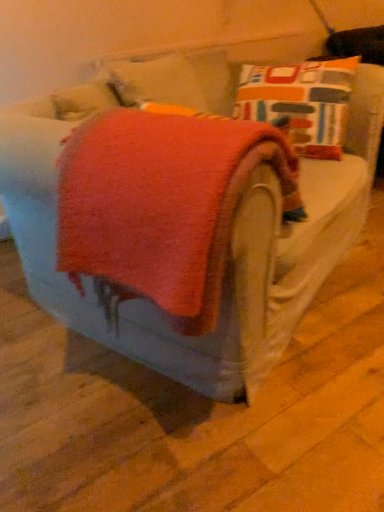
Question: Is orange soft towel at center beside orange fabric at center?

Choices:
 (A) no
 (B) yes

Answer: (A)

Question: Is orange soft towel at center positioned far away from orange fabric at center?

Choices:
 (A) no
 (B) yes

Answer: (A)

Question: Is orange soft towel at center oriented away from orange fabric at center?

Choices:
 (A) no
 (B) yes

Answer: (A)

Question: Is orange soft towel at center shorter than orange fabric at center?

Choices:
 (A) no
 (B) yes

Answer: (A)

Question: From a real-world perspective, is orange soft towel at center located beneath orange fabric at center?

Choices:
 (A) no
 (B) yes

Answer: (A)

Question: From the image's perspective, does orange soft towel at center appear lower than orange fabric at center?

Choices:
 (A) no
 (B) yes

Answer: (A)

Question: Can you confirm if orange fabric at center is thinner than orange soft towel at center?

Choices:
 (A) no
 (B) yes

Answer: (A)

Question: Considering the relative sizes of orange fabric at center and orange soft towel at center in the image provided, is orange fabric at center bigger than orange soft towel at center?

Choices:
 (A) no
 (B) yes

Answer: (B)

Question: Does orange fabric at center have a smaller size compared to orange soft towel at center?

Choices:
 (A) no
 (B) yes

Answer: (A)

Question: Is orange fabric at center not close to orange soft towel at center?

Choices:
 (A) no
 (B) yes

Answer: (A)

Question: Is orange fabric at center shorter than orange soft towel at center?

Choices:
 (A) no
 (B) yes

Answer: (B)

Question: From the image's perspective, is orange fabric at center beneath orange soft towel at center?

Choices:
 (A) no
 (B) yes

Answer: (B)

Question: From the image's perspective, is orange fabric at center positioned above or below orange soft towel at center?

Choices:
 (A) above
 (B) below

Answer: (B)